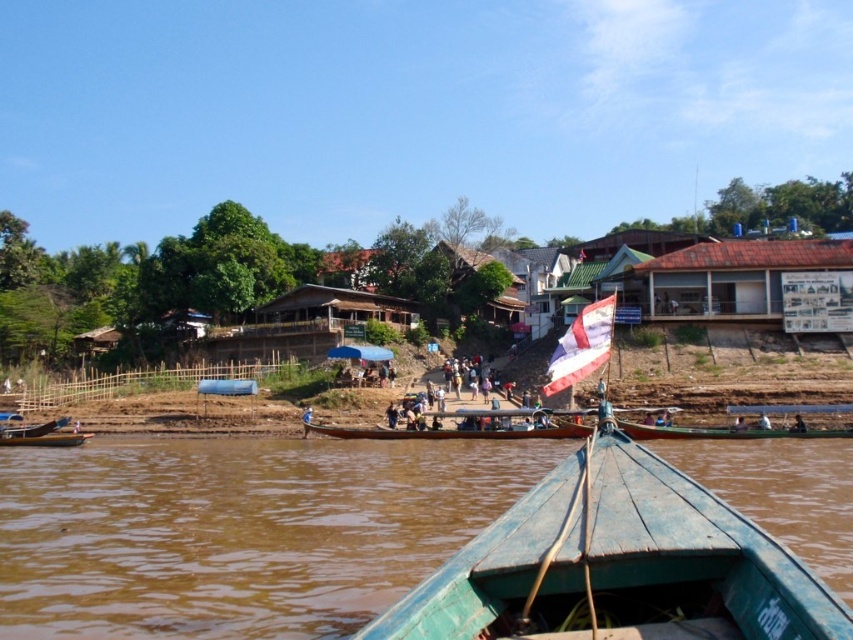
You are a tourist standing at the riverside and want to find the wooden hut at center. Which direction should you look to see the brown corrugated metal hut at upper right relative to it?

The brown corrugated metal hut at upper right is above the wooden hut at center, so you should look upward from the wooden hut at center to see it.

You are planning to take a boat ride on the river and need to know if the brown wooden boat at center can fit under the wooden houses at center. Based on the scene description, can it?

The brown wooden boat at center is shorter than wooden houses at center, so it can fit under them without any issues.

You are standing at the riverbank and want to go to the brown corrugated metal hut at upper right and the wooden hut at center. Which one is closer to you?

The brown corrugated metal hut at upper right is closer to you than the wooden hut at center.